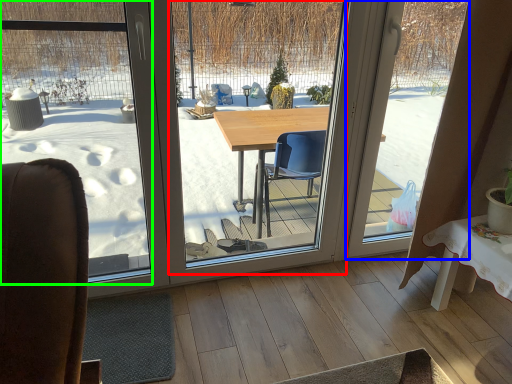
Question: Considering the real-world distances, which object is closest to window screen (highlighted by a red box)? window screen (highlighted by a blue box) or window screen (highlighted by a green box).

Choices:
 (A) window screen
 (B) window screen

Answer: (B)